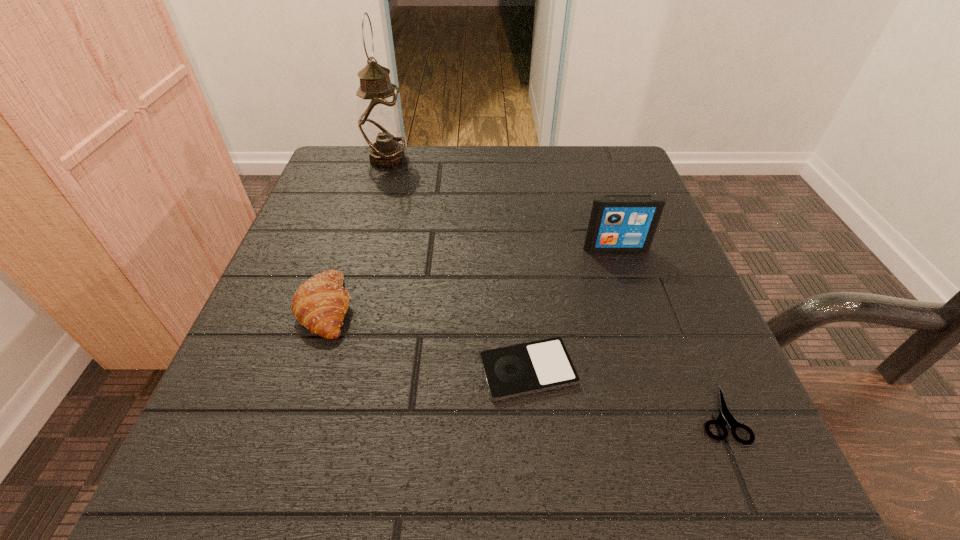
Locate an element on the screen. This screenshot has width=960, height=540. free spot located 0.060m on the front of the crescent roll is located at coordinates (303, 377).

Where is `free space located on the front of the second shortest object`? free space located on the front of the second shortest object is located at coordinates 535,446.

Find the location of a particular element. The width and height of the screenshot is (960, 540). vacant space located on the left of the shortest object is located at coordinates (615, 414).

Identify the location of object at the far edge. This screenshot has width=960, height=540. (381, 124).

The width and height of the screenshot is (960, 540). What are the coordinates of `object that is at the near edge` in the screenshot? It's located at (725, 416).

This screenshot has height=540, width=960. What are the coordinates of `oil lamp at the left edge` in the screenshot? It's located at (381, 124).

The image size is (960, 540). Identify the location of crescent roll located at the left edge. (320, 304).

Locate an element on the screen. This screenshot has height=540, width=960. iPod that is at the right edge is located at coordinates (618, 223).

Identify the location of shears present at the right edge. This screenshot has width=960, height=540. (725, 416).

The width and height of the screenshot is (960, 540). I want to click on object that is at the far left corner, so click(381, 124).